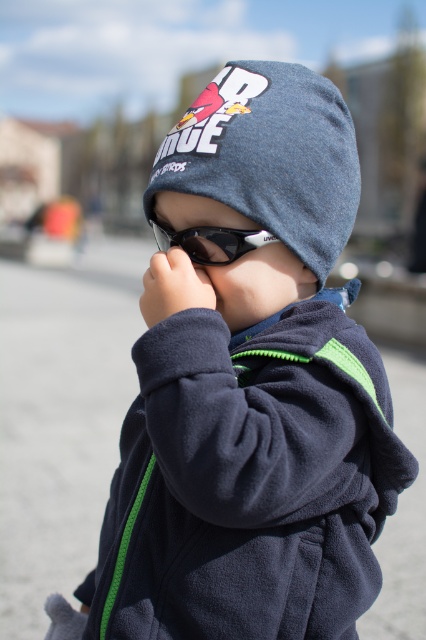
Question: Which object is farther from the camera taking this photo?

Choices:
 (A) denim knit beanie at center
 (B) black plastic goggles at center

Answer: (B)

Question: Does dark gray fleece hand at center appear under black plastic goggles at center?

Choices:
 (A) no
 (B) yes

Answer: (B)

Question: Among these points, which one is nearest to the camera?

Choices:
 (A) (336, 200)
 (B) (163, 234)
 (C) (207, 298)

Answer: (C)

Question: Which point is closer to the camera taking this photo?

Choices:
 (A) (184, 244)
 (B) (276, 70)
 (C) (189, 307)

Answer: (C)

Question: Does dark gray fleece hand at center appear on the left side of black plastic goggles at center?

Choices:
 (A) no
 (B) yes

Answer: (B)

Question: Is dark gray fleece hand at center to the right of black plastic goggles at center from the viewer's perspective?

Choices:
 (A) no
 (B) yes

Answer: (A)